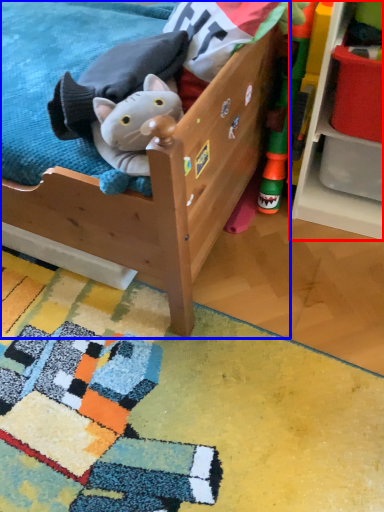
Question: Which object is further to the camera taking this photo, shelf (highlighted by a red box) or furniture (highlighted by a blue box)?

Choices:
 (A) shelf
 (B) furniture

Answer: (A)